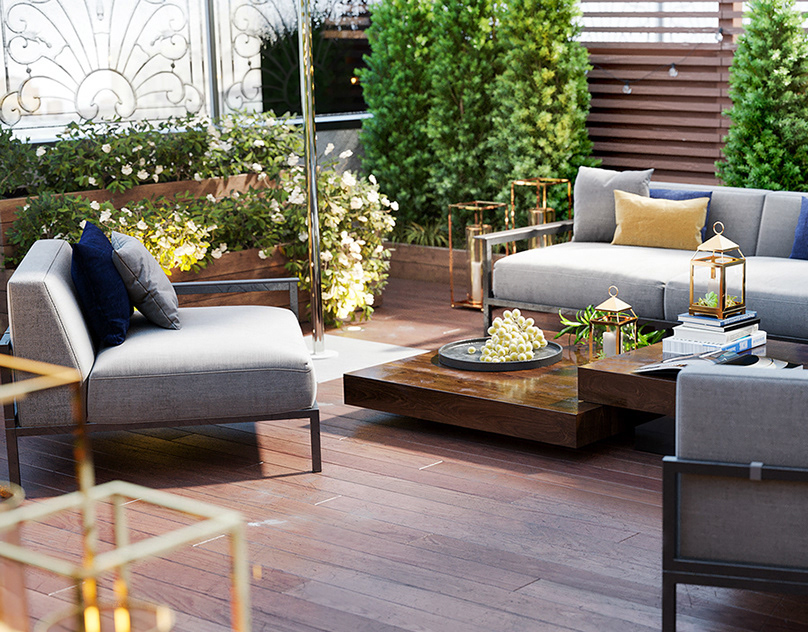
Where is `tables side brass`? The width and height of the screenshot is (808, 632). tables side brass is located at coordinates (112, 579), (478, 241), (540, 210).